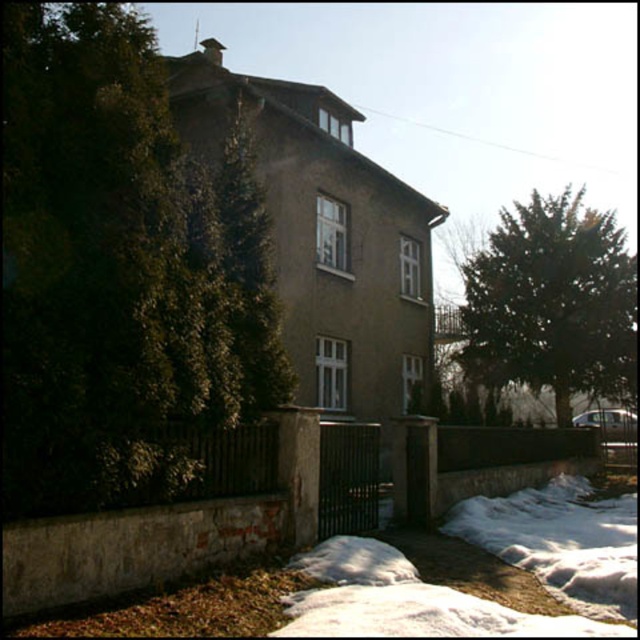
Question: Does green leafy tree at left have a smaller size compared to dark green textured tree at right?

Choices:
 (A) yes
 (B) no

Answer: (A)

Question: Which object appears closest to the camera in this image?

Choices:
 (A) dark green textured tree at right
 (B) white fluffy snow at lower center
 (C) green leafy tree at left

Answer: (C)

Question: Which is nearer to the green leafy tree at left?

Choices:
 (A) white fluffy snow at lower center
 (B) dark green textured tree at right

Answer: (A)

Question: Which object is positioned farthest from the green leafy tree at left?

Choices:
 (A) dark green textured tree at right
 (B) white fluffy snow at lower center

Answer: (A)

Question: Can you confirm if white fluffy snow at lower center is bigger than dark green textured tree at right?

Choices:
 (A) yes
 (B) no

Answer: (B)

Question: Is green leafy tree at left wider than dark green textured tree at right?

Choices:
 (A) no
 (B) yes

Answer: (A)